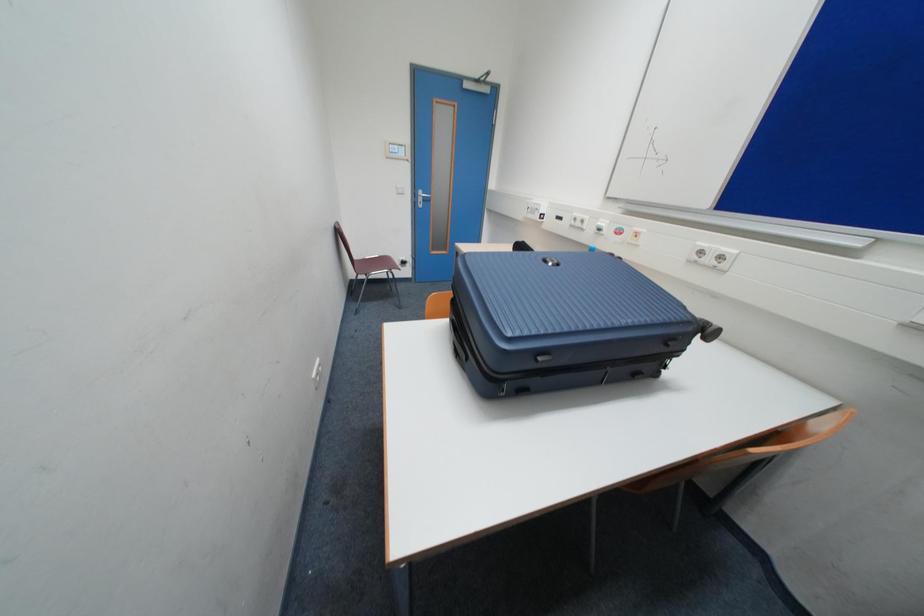
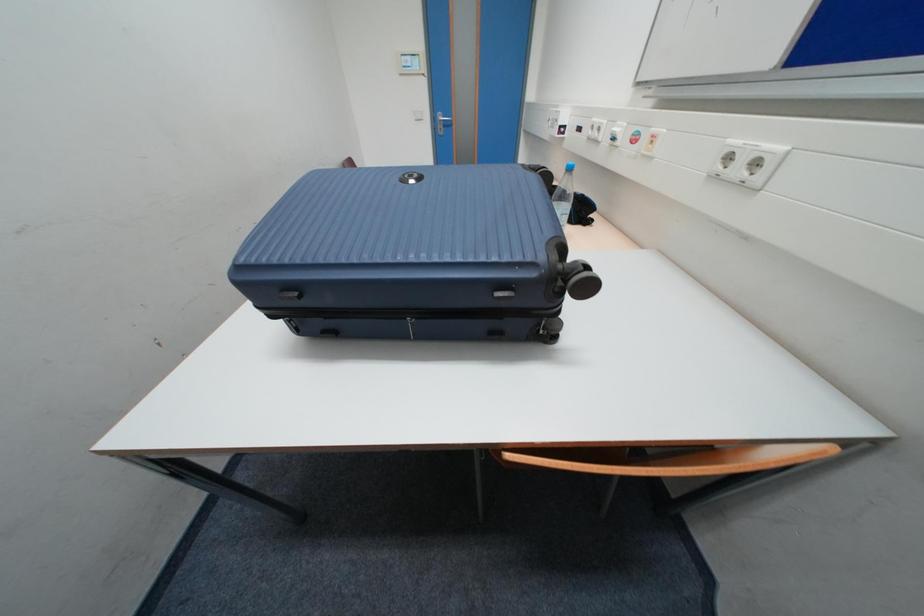
Question: What movement of the cameraman would produce the second image?

Choices:
 (A) Left
 (B) Right
 (C) Forward
 (D) Backward

Answer: (B)